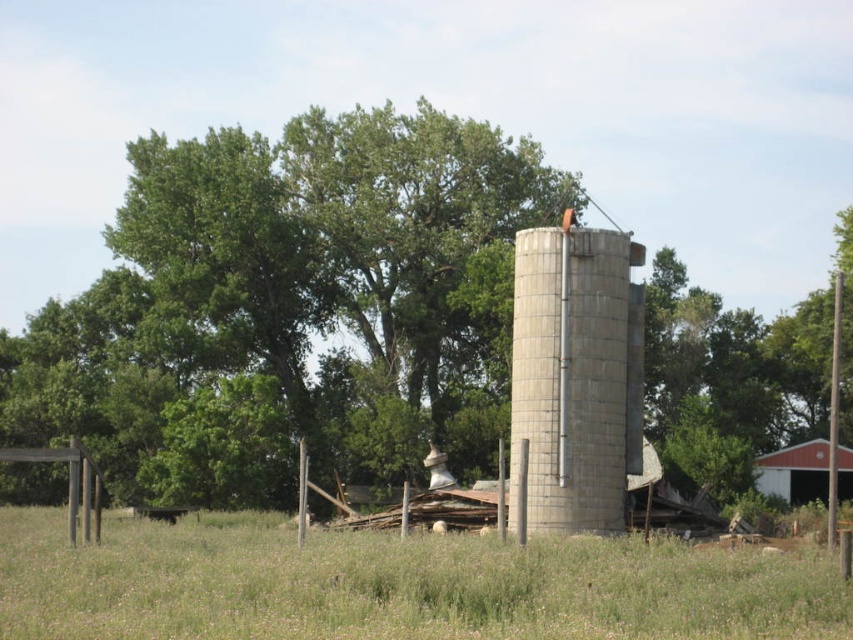
Can you confirm if gray concrete silo at center is taller than red wood barn at lower right?

Yes.

At what (x,y) coordinates should I click in order to perform the action: click on gray concrete silo at center. Please return your answer as a coordinate pair (x, y). This screenshot has height=640, width=853. Looking at the image, I should click on (575, 376).

Locate an element on the screen. This screenshot has width=853, height=640. gray concrete silo at center is located at coordinates (575, 376).

Can you confirm if green grass at center is bigger than red wood barn at lower right?

Yes.

Who is lower down, green grass at center or red wood barn at lower right?

red wood barn at lower right is below.

Describe the element at coordinates (399, 586) in the screenshot. This screenshot has width=853, height=640. I see `green grass at center` at that location.

Image resolution: width=853 pixels, height=640 pixels. In order to click on green grass at center in this screenshot , I will do `click(399, 586)`.

Is point (149, 628) more distant than point (619, 296)?

No.

Does green grass at center have a greater height compared to gray concrete silo at center?

No, green grass at center is not taller than gray concrete silo at center.

I want to click on green grass at center, so click(399, 586).